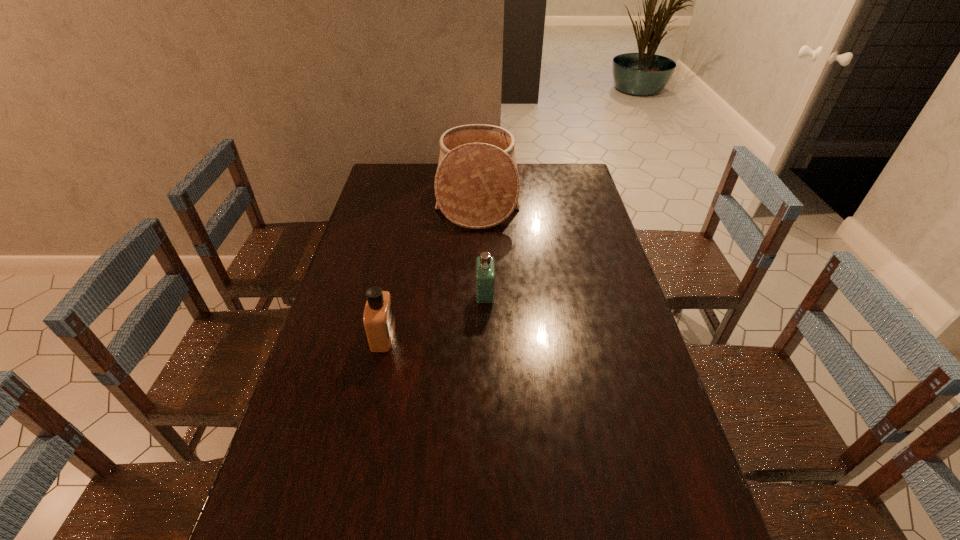
Locate an element on the screen. This screenshot has width=960, height=540. the tallest object is located at coordinates (477, 185).

The image size is (960, 540). I want to click on the farthest object, so click(x=477, y=185).

The width and height of the screenshot is (960, 540). In order to click on the farther perfume in this screenshot , I will do [x=485, y=271].

Image resolution: width=960 pixels, height=540 pixels. What are the coordinates of `the right perfume` in the screenshot? It's located at (485, 271).

Identify the location of the nearest object. (378, 317).

Where is `the nearer perfume`? the nearer perfume is located at coordinates (378, 317).

Where is `free location located with the lid open on the tallest object`? free location located with the lid open on the tallest object is located at coordinates (536, 197).

Image resolution: width=960 pixels, height=540 pixels. I want to click on free region located 0.390m on the front label of the farther perfume, so click(349, 298).

Identify the location of free space located on the front label of the farther perfume. (362, 298).

Image resolution: width=960 pixels, height=540 pixels. Find the location of `vacant area located 0.090m on the front label of the farther perfume`. vacant area located 0.090m on the front label of the farther perfume is located at coordinates (446, 298).